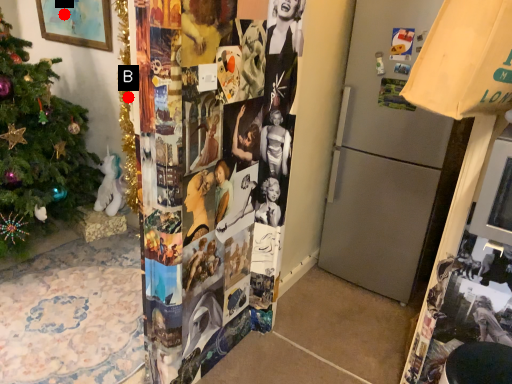
Question: Two points are circled on the image, labeled by A and B beside each circle. Which point is further to the camera?

Choices:
 (A) A is further
 (B) B is further

Answer: (A)